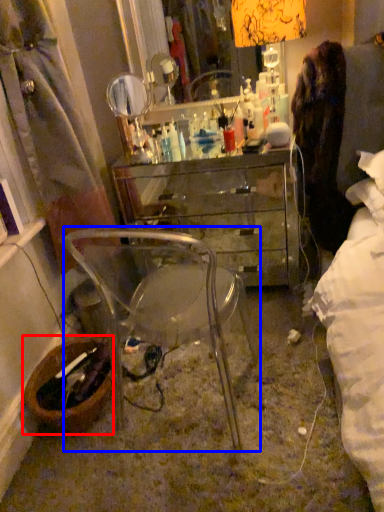
Question: Which point is closer to the camera, picnic basket (highlighted by a red box) or chair (highlighted by a blue box)?

Choices:
 (A) picnic basket
 (B) chair

Answer: (B)